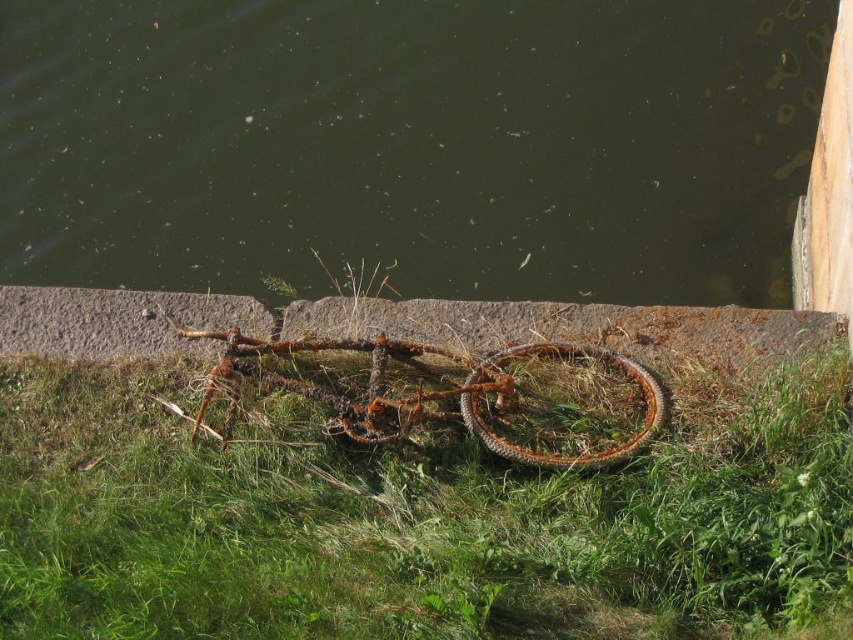
From the picture: You are standing at the point marked by the coordinates point (x=410, y=144). Looking around, you see a rusted bicycle lying on its side on a grassy area near a body of water. Which direction should you walk to reach the green murky water at center?

The point (x=410, y=144) is already at the green murky water at center, so you are already there.

You are standing at the edge of the grassy area near the water and want to walk to the rusty metal bicycle at center. Which direction should you move relative to the green grass at center?

You should move to the right of the green grass at center to reach the rusty metal bicycle at center because the green grass at center is located to the left of the rusty metal bicycle at center.

From the picture: You are standing at point (410, 144) in the scene. What do you see immediately around you?

You see green murky water at center immediately around you.